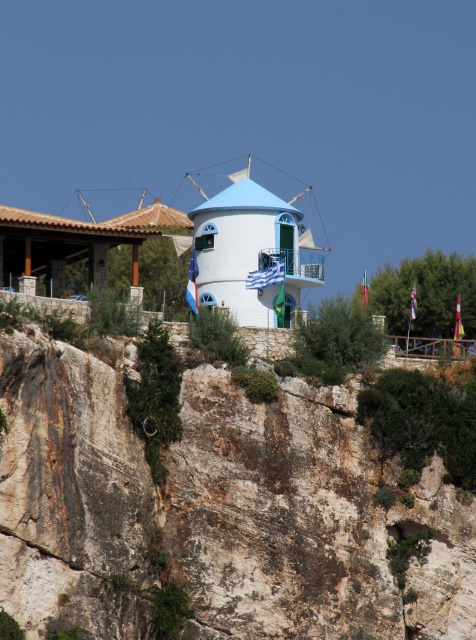
Who is lower down, white stone cliff at center or white matte windmill at center?

Positioned lower is white stone cliff at center.

Which is more to the left, white stone cliff at center or white matte windmill at center?

Positioned to the left is white stone cliff at center.

The height and width of the screenshot is (640, 476). What do you see at coordinates (217, 513) in the screenshot? I see `white stone cliff at center` at bounding box center [217, 513].

You are a GUI agent. You are given a task and a screenshot of the screen. Output one action in this format:
    pyautogui.click(x=<x>, y=<y>)
    Task: Click on the white stone cliff at center
    
    Given the screenshot: What is the action you would take?
    pyautogui.click(x=217, y=513)